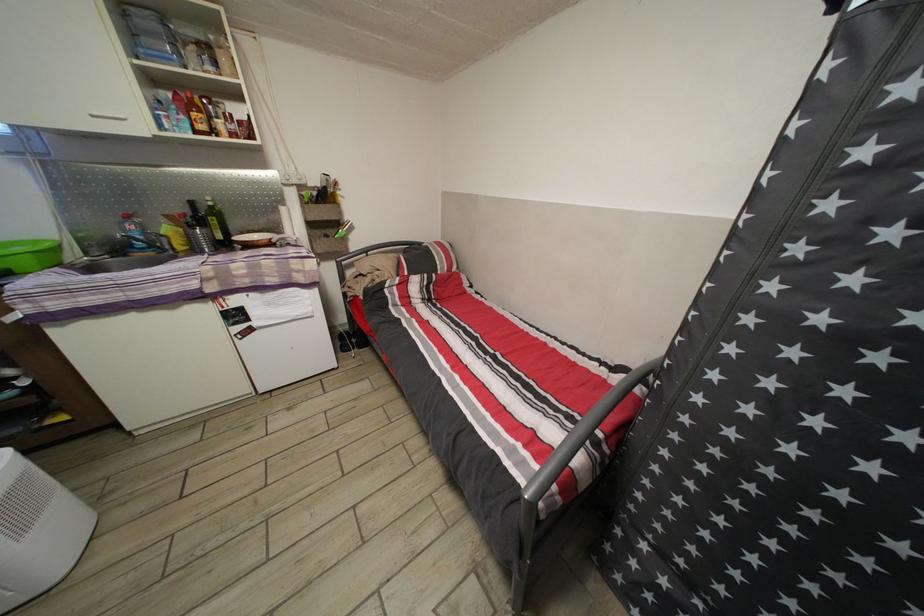
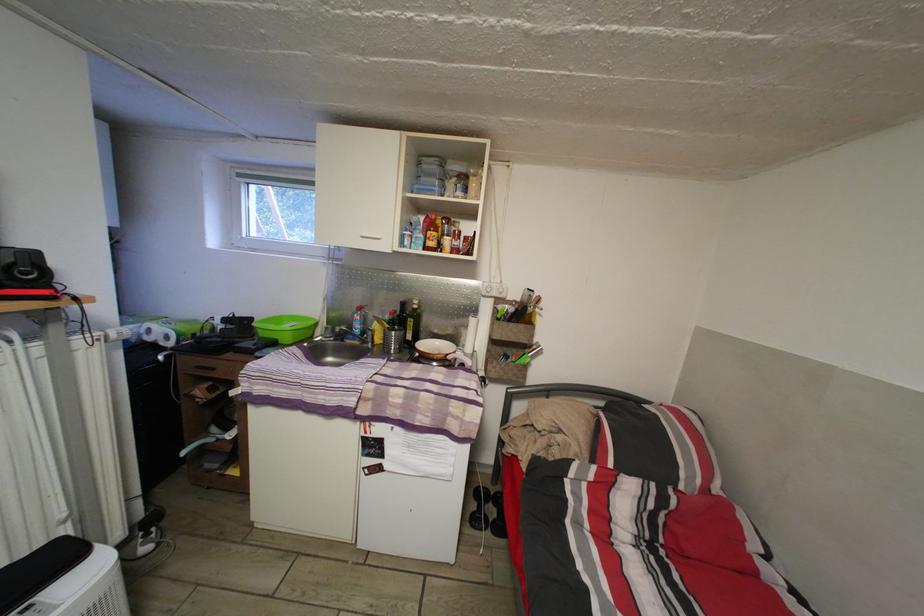
Find the pixel in the second image that matches pixel 354 339 in the first image.

(493, 498)